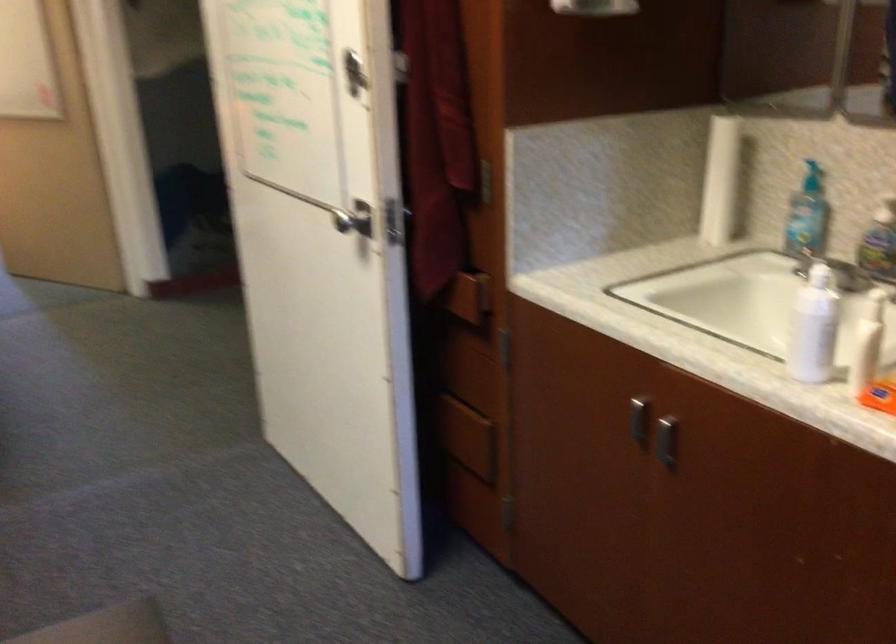
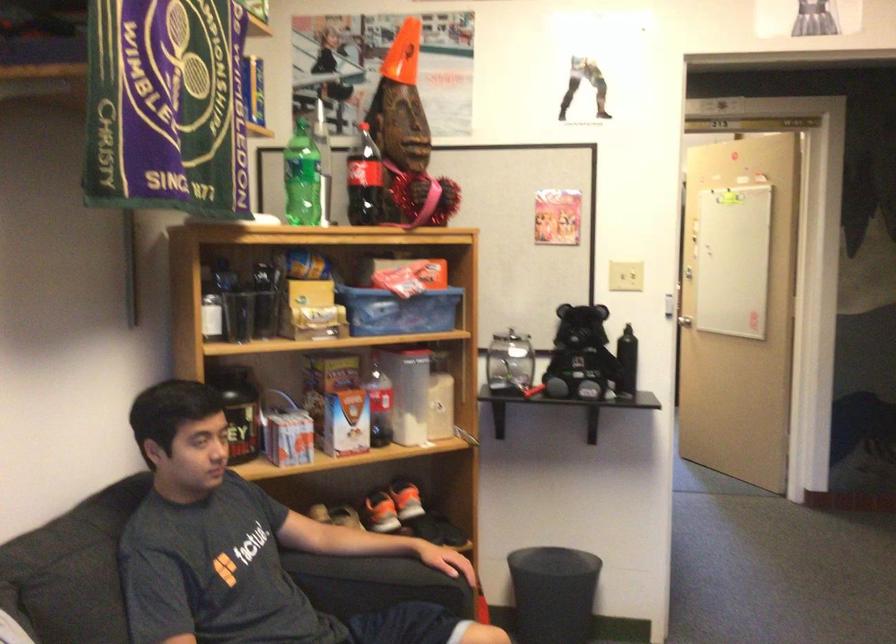
Question: The camera is either moving clockwise (left) or counter-clockwise (right) around the object. The first image is from the beginning of the video and the second image is from the end. Is the camera moving left or right when shooting the video?

Choices:
 (A) Left
 (B) Right

Answer: (B)